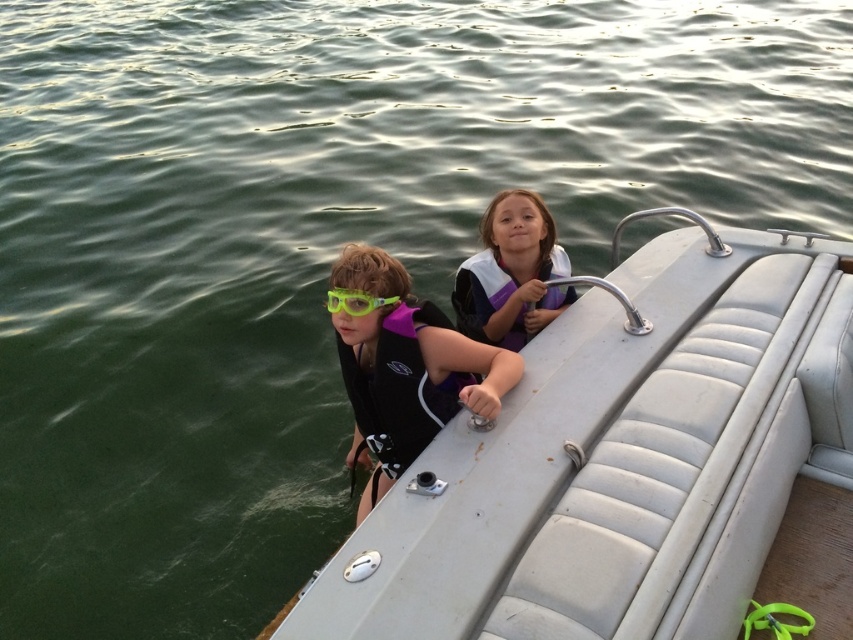
Does silver leather boat at center appear on the right side of purple matte life vest at center?

Correct, you'll find silver leather boat at center to the right of purple matte life vest at center.

Can you confirm if silver leather boat at center is positioned above purple matte life vest at center?

Actually, silver leather boat at center is below purple matte life vest at center.

Between point (810, 442) and point (401, 374), which one is positioned behind?

Point (810, 442)

This screenshot has width=853, height=640. Find the location of `silver leather boat at center`. silver leather boat at center is located at coordinates (630, 467).

Between purple neoprene life jacket at left and purple/white life jacket at upper center, which one has more height?

Standing taller between the two is purple neoprene life jacket at left.

Identify the location of purple neoprene life jacket at left. (399, 385).

Does purple neoprene life jacket at left lie in front of green matte goggles at center?

No, purple neoprene life jacket at left is behind green matte goggles at center.

Can you confirm if purple neoprene life jacket at left is bigger than green matte goggles at center?

Yes, purple neoprene life jacket at left is bigger than green matte goggles at center.

Which is in front, point (351, 352) or point (344, 298)?

Point (344, 298)

Locate an element on the screen. purple neoprene life jacket at left is located at coordinates (399, 385).